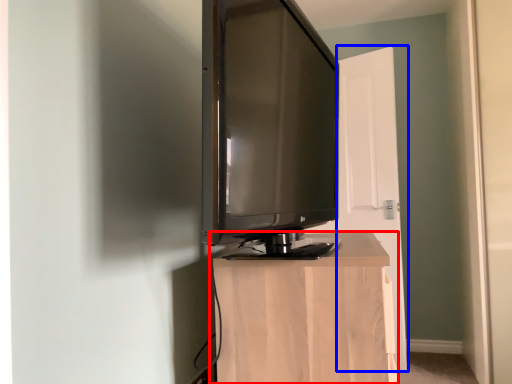
Question: Which object appears closest to the camera in this image, furniture (highlighted by a red box) or door (highlighted by a blue box)?

Choices:
 (A) furniture
 (B) door

Answer: (A)